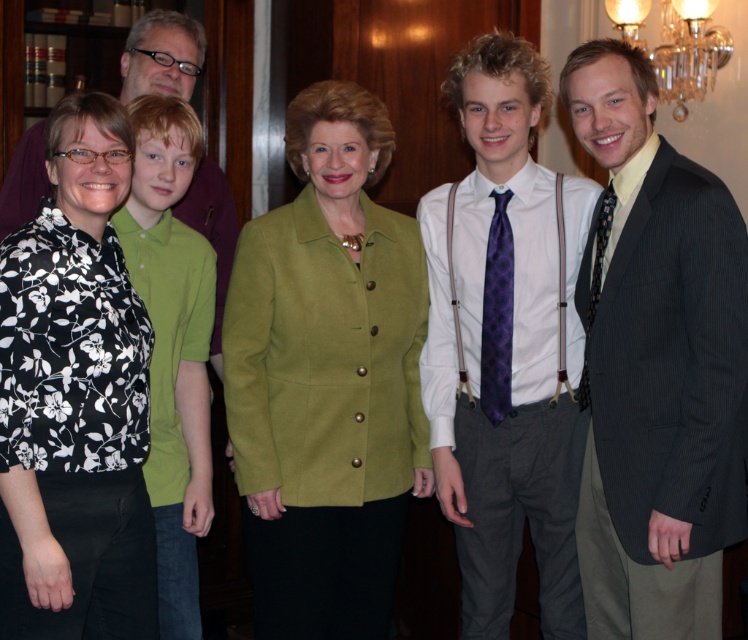
Question: Does matte purple tie at center have a greater width compared to black dotted tie at right?

Choices:
 (A) yes
 (B) no

Answer: (A)

Question: Which point appears closest to the camera in this image?

Choices:
 (A) (491, 381)
 (B) (19, 156)

Answer: (A)

Question: Which point appears closest to the camera in this image?

Choices:
 (A) (597, 300)
 (B) (426, 225)

Answer: (A)

Question: Does purple tie at center lie in front of matte purple tie at center?

Choices:
 (A) yes
 (B) no

Answer: (A)

Question: Which point is farther to the camera?

Choices:
 (A) (479, 385)
 (B) (586, 272)
 (C) (705, 0)

Answer: (C)

Question: Can you confirm if black floral blouse at left is positioned to the left of matte purple tie at center?

Choices:
 (A) yes
 (B) no

Answer: (A)